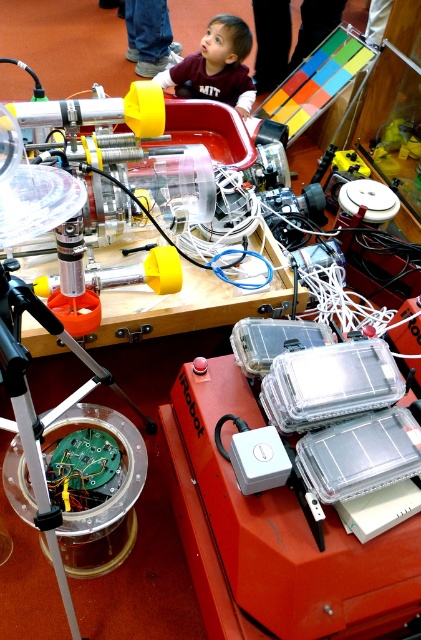
Question: Does silver metallic tripod at lower left appear under maroon cotton shirt at upper center?

Choices:
 (A) no
 (B) yes

Answer: (B)

Question: In this image, where is silver metallic tripod at lower left located relative to maroon cotton shirt at upper center?

Choices:
 (A) left
 (B) right

Answer: (A)

Question: Is silver metallic tripod at lower left to the right of maroon cotton shirt at upper center from the viewer's perspective?

Choices:
 (A) no
 (B) yes

Answer: (A)

Question: Which point appears closest to the camera in this image?

Choices:
 (A) (56, 563)
 (B) (208, 80)

Answer: (A)

Question: Which object appears closest to the camera in this image?

Choices:
 (A) silver metallic tripod at lower left
 (B) maroon cotton shirt at upper center

Answer: (A)